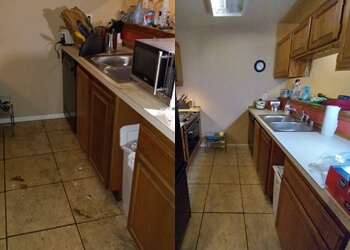
This screenshot has width=350, height=250. Identify the location of beige wall. (227, 65).